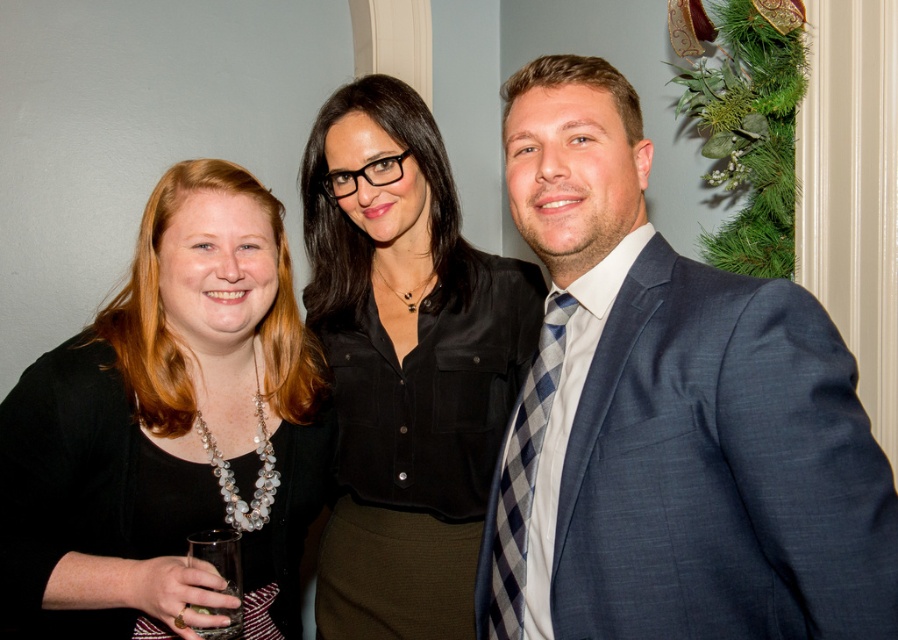
Question: Which object appears closest to the camera in this image?

Choices:
 (A) black matte necklace at left
 (B) black satin blouse at center

Answer: (A)

Question: Observing the image, what is the correct spatial positioning of black matte necklace at left in reference to blue plaid tie at right?

Choices:
 (A) right
 (B) left

Answer: (B)

Question: Which object appears farthest from the camera in this image?

Choices:
 (A) black matte necklace at left
 (B) blue textured suit at center

Answer: (A)

Question: Is blue textured suit at center below blue plaid tie at right?

Choices:
 (A) yes
 (B) no

Answer: (B)

Question: Is black matte necklace at left to the right of blue plaid tie at right from the viewer's perspective?

Choices:
 (A) yes
 (B) no

Answer: (B)

Question: Which object is closer to the camera taking this photo?

Choices:
 (A) blue textured suit at center
 (B) blue plaid tie at right
 (C) black satin blouse at center

Answer: (A)